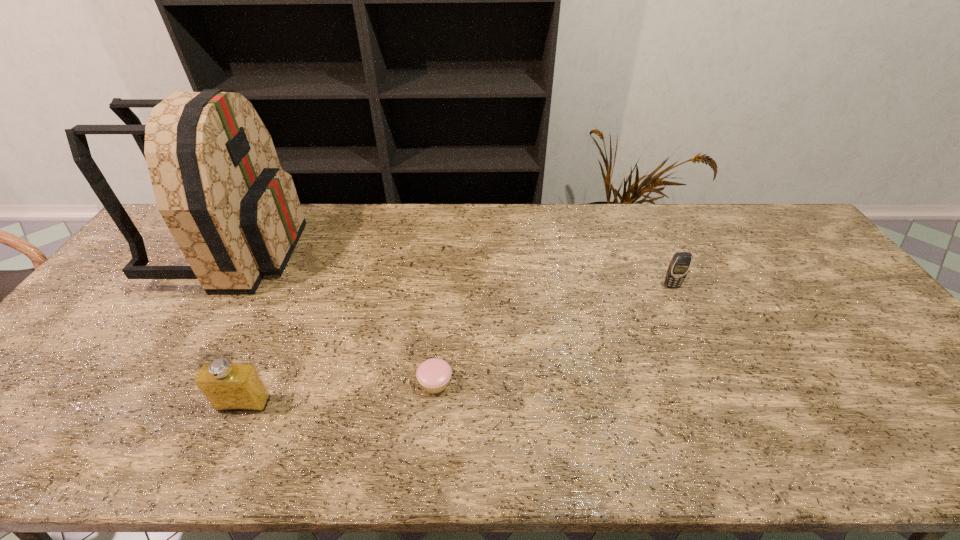
Locate an element on the screen. This screenshot has width=960, height=540. backpack is located at coordinates (235, 214).

Find the location of a particular element. The width and height of the screenshot is (960, 540). the third shortest object is located at coordinates (228, 387).

This screenshot has width=960, height=540. I want to click on cellular telephone, so click(x=679, y=266).

Where is `the rightmost object`? This screenshot has height=540, width=960. the rightmost object is located at coordinates (679, 266).

This screenshot has width=960, height=540. Find the location of `the second object from right to left`. the second object from right to left is located at coordinates (433, 374).

Locate an element on the screen. This screenshot has height=540, width=960. cupcake is located at coordinates (433, 374).

Where is `vacant point located 0.330m on the front face of the tallest object`? This screenshot has height=540, width=960. vacant point located 0.330m on the front face of the tallest object is located at coordinates (401, 251).

You are a GUI agent. You are given a task and a screenshot of the screen. Output one action in this format:
    pyautogui.click(x=<x>, y=<y>)
    Task: Click on the free spot located on the front-facing side of the perfume
    
    Given the screenshot: What is the action you would take?
    pyautogui.click(x=223, y=451)

I want to click on vacant region located on the front face of the cellular telephone, so click(689, 326).

I want to click on vacant space located on the left of the cupcake, so click(x=326, y=383).